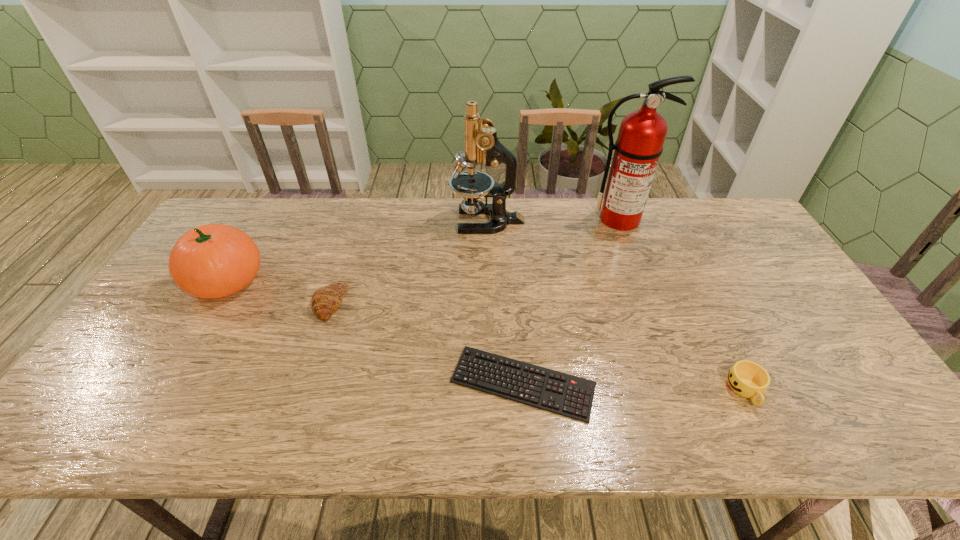
This screenshot has height=540, width=960. Find the location of `vacant point at the far edge`. vacant point at the far edge is located at coordinates (543, 208).

In the image, there is a desktop. Where is `free space at the near edge`? The image size is (960, 540). free space at the near edge is located at coordinates (303, 411).

The height and width of the screenshot is (540, 960). In the image, there is a desktop. What are the coordinates of `vacant space at the left edge` in the screenshot? It's located at [202, 300].

You are a GUI agent. You are given a task and a screenshot of the screen. Output one action in this format:
    pyautogui.click(x=<x>, y=<y>)
    Task: Click on the free region at the right edge
    Image resolution: width=960 pixels, height=540 pixels.
    Given the screenshot: What is the action you would take?
    pyautogui.click(x=780, y=351)

Identify the location of free point at the far right corner. (739, 208).

Locate an element on the screen. The height and width of the screenshot is (540, 960). free space between the shortest object and the cup is located at coordinates (635, 387).

The width and height of the screenshot is (960, 540). Find the location of `vacant area that lies between the third tallest object and the second object from left to right`. vacant area that lies between the third tallest object and the second object from left to right is located at coordinates (278, 292).

Find the location of a particular element. The height and width of the screenshot is (540, 960). vacant area between the cup and the leftmost object is located at coordinates (486, 335).

Locate an element on the screen. unoccupied position between the second tallest object and the cup is located at coordinates (616, 306).

The image size is (960, 540). In order to click on empty space between the fire extinguisher and the crescent roll in this screenshot , I will do `click(474, 261)`.